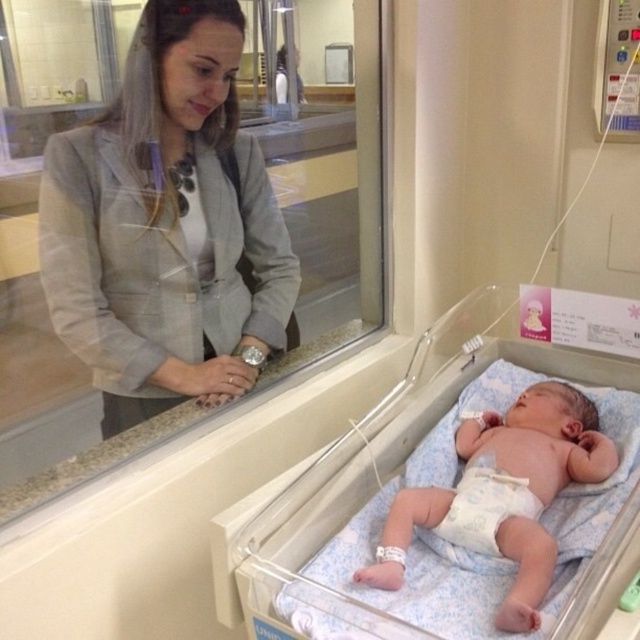
Question: Can you confirm if gray textured blazer at upper left is smaller than light blue diapered baby at lower right?

Choices:
 (A) yes
 (B) no

Answer: (B)

Question: Which point is closer to the camera?

Choices:
 (A) white cloth diaper at center
 (B) gray textured blazer at upper left
 (C) white fabric hospital bed at lower center
 (D) light blue diapered baby at lower right

Answer: (C)

Question: Which point appears closest to the camera in this image?

Choices:
 (A) (436, 532)
 (B) (208, 170)
 (C) (272, 561)

Answer: (C)

Question: Which object is closer to the camera taking this photo?

Choices:
 (A) gray textured blazer at upper left
 (B) white fabric hospital bed at lower center
 (C) white cloth diaper at center

Answer: (B)

Question: Is the position of white fabric hospital bed at lower center more distant than that of light blue diapered baby at lower right?

Choices:
 (A) yes
 (B) no

Answer: (B)

Question: Does light blue diapered baby at lower right appear on the left side of white cloth diaper at center?

Choices:
 (A) yes
 (B) no

Answer: (B)